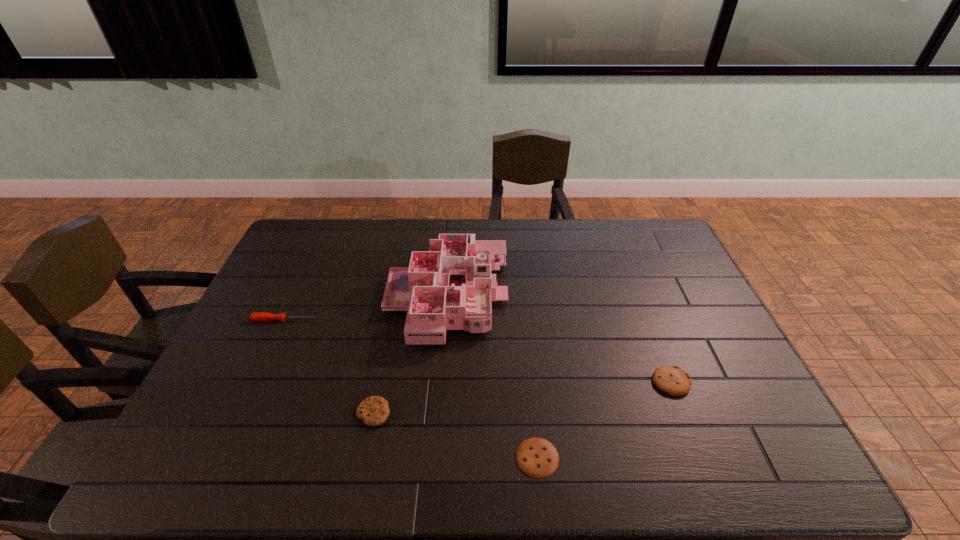
I want to click on free space that satisfies the following two spatial constraints: 1. at the front entrance of the dollhouse; 2. on the left side of the farthest cookie, so click(x=441, y=382).

The height and width of the screenshot is (540, 960). What are the coordinates of `free space that satisfies the following two spatial constraints: 1. at the tip of the screwdriver; 2. on the right side of the second nearest cookie` in the screenshot? It's located at (242, 413).

Locate an element on the screen. This screenshot has height=540, width=960. vacant area that satisfies the following two spatial constraints: 1. at the tip of the second shortest cookie; 2. on the left side of the leftmost object is located at coordinates (242, 413).

Identify the location of free spot that satisfies the following two spatial constraints: 1. on the front side of the shortest cookie; 2. on the left side of the second nearest object. (365, 457).

The image size is (960, 540). I want to click on free space in the image that satisfies the following two spatial constraints: 1. at the tip of the fourth farthest object; 2. on the left side of the screwdriver, so click(x=242, y=413).

Where is `free spot that satisfies the following two spatial constraints: 1. on the back side of the farthest cookie; 2. at the front entrance of the dollhouse`? This screenshot has width=960, height=540. free spot that satisfies the following two spatial constraints: 1. on the back side of the farthest cookie; 2. at the front entrance of the dollhouse is located at coordinates (638, 298).

This screenshot has width=960, height=540. Identify the location of free space that satisfies the following two spatial constraints: 1. at the tip of the second cookie from right to left; 2. on the left side of the leftmost object. (222, 457).